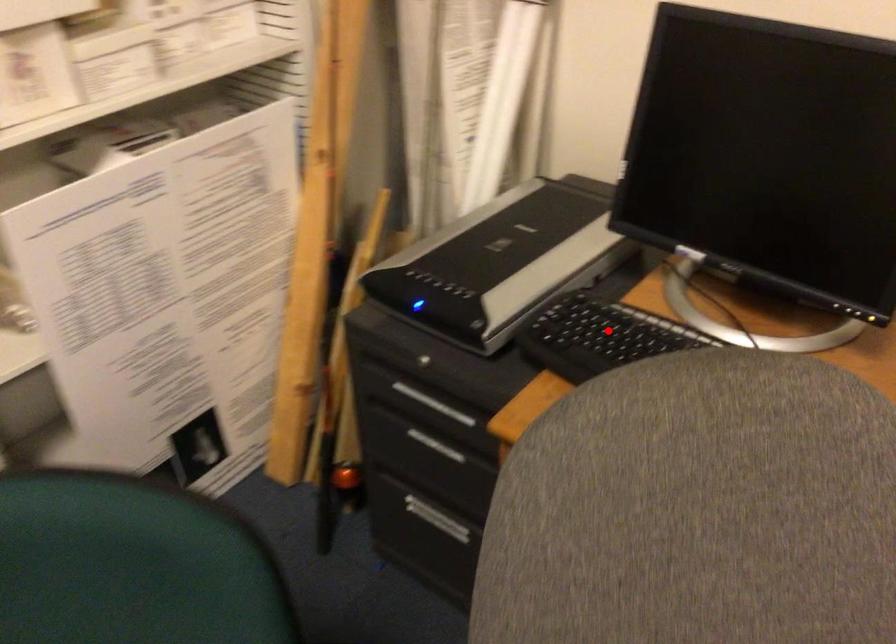
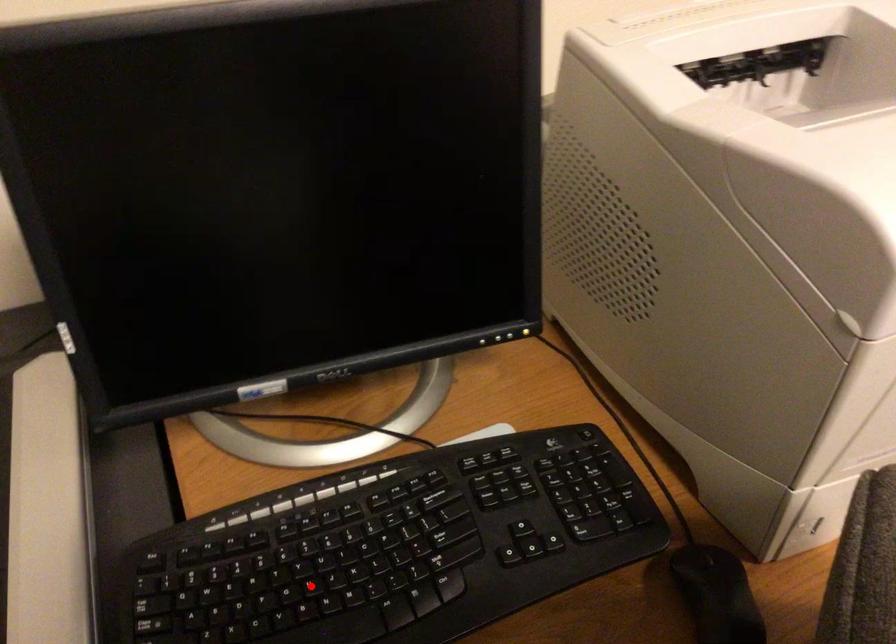
I am providing you with two images of the same scene from different viewpoints. A red point is marked on the first image and another point is marked on the second image. Is the red point in image1 aligned with the point shown in image2?

No